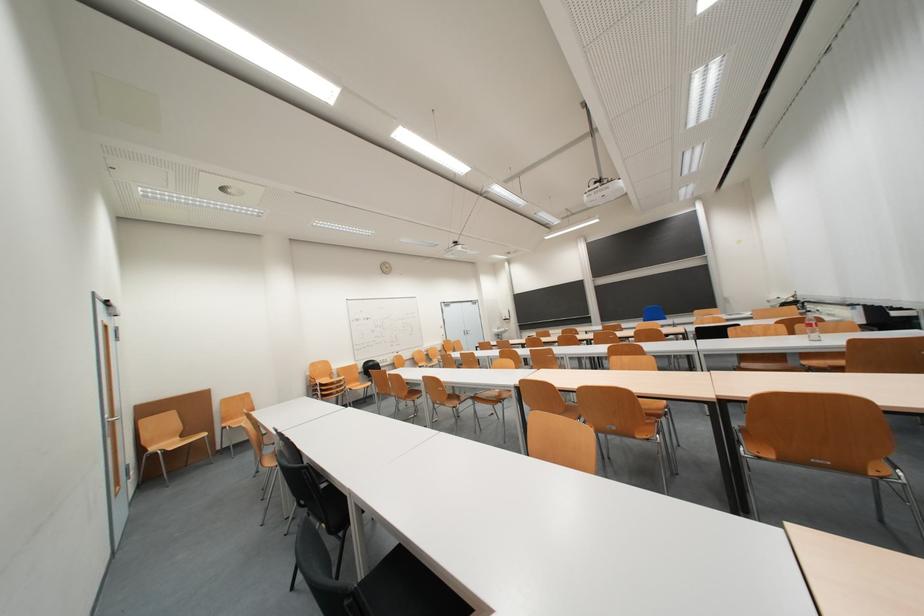
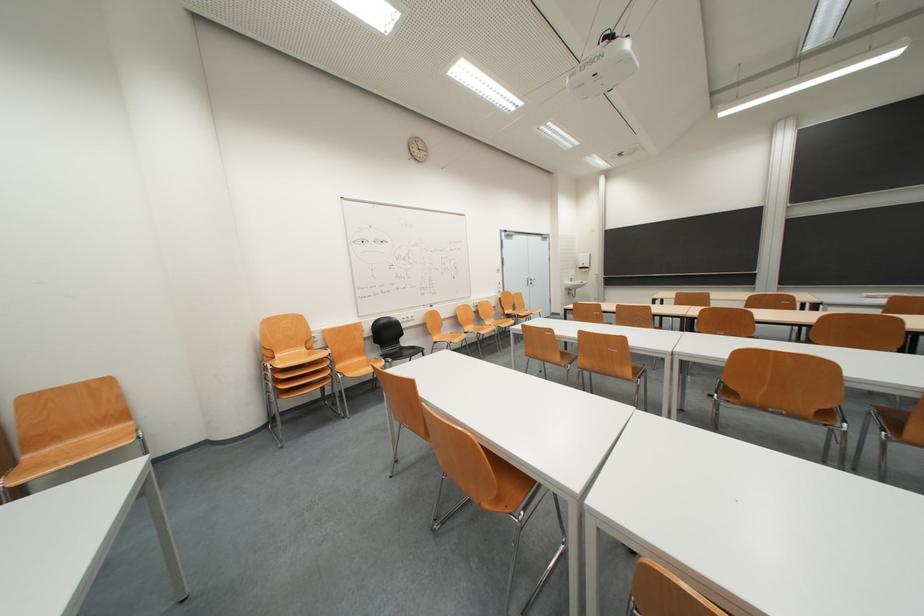
In the second image, find the point that corresponds to pixel 504 336 in the first image.

(575, 288)